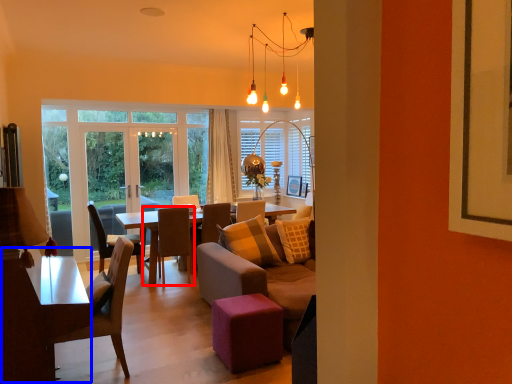
Question: Which object appears farthest to the camera in this image, chair (highlighted by a red box) or table (highlighted by a blue box)?

Choices:
 (A) chair
 (B) table

Answer: (A)